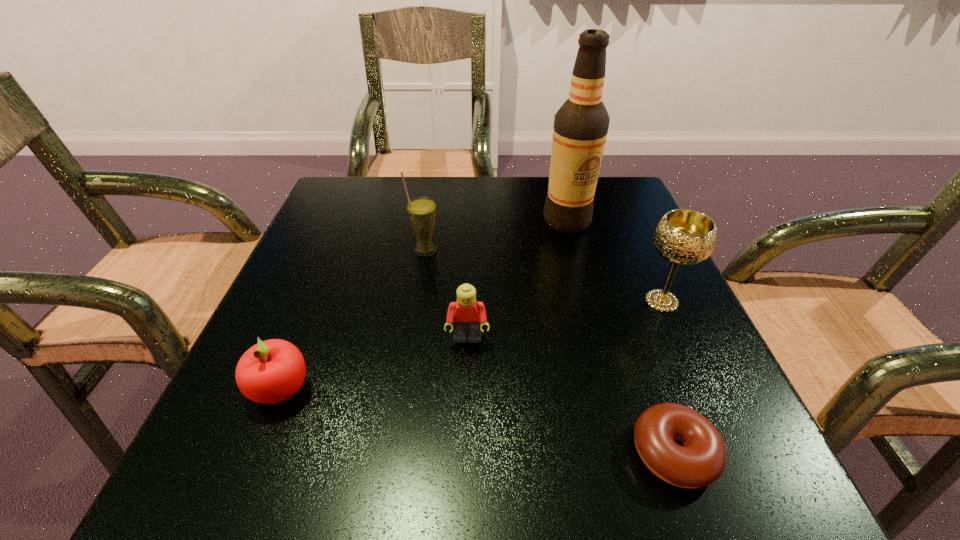
Image resolution: width=960 pixels, height=540 pixels. I want to click on vacant space that is in between the alcohol and the leftmost object, so click(424, 305).

At what (x,y) coordinates should I click in order to perform the action: click on free area in between the fourth nearest object and the straw for drinking. Please return your answer as a coordinate pair (x, y). Looking at the image, I should click on (543, 276).

The image size is (960, 540). What are the coordinates of `free spot between the shortest object and the tallest object` in the screenshot? It's located at (620, 336).

This screenshot has height=540, width=960. What are the coordinates of `vacant space in between the chalice and the shortest object` in the screenshot? It's located at (667, 377).

This screenshot has width=960, height=540. Identify the location of free point between the third nearest object and the leftmost object. (374, 364).

Locate an element on the screen. vacant region between the shortest object and the farthest object is located at coordinates (620, 336).

You are a GUI agent. You are given a task and a screenshot of the screen. Output one action in this format:
    pyautogui.click(x=<x>, y=<y>)
    Task: Click on the blank region between the apple and the alcohol
    
    Given the screenshot: What is the action you would take?
    pos(424,305)

The image size is (960, 540). Identify the location of empty space between the straw for drinking and the farthest object. pyautogui.click(x=496, y=235).

Find the location of a particular element. The width and height of the screenshot is (960, 540). vacant area between the second farthest object and the fourth farthest object is located at coordinates (446, 295).

Locate which object ranks fourth in proximity to the third nearest object. Please provide its 2D coordinates. Your answer should be formatted as a tuple, i.e. [(x, y)], where the tuple contains the x and y coordinates of a point satisfying the conditions above.

[(683, 237)]